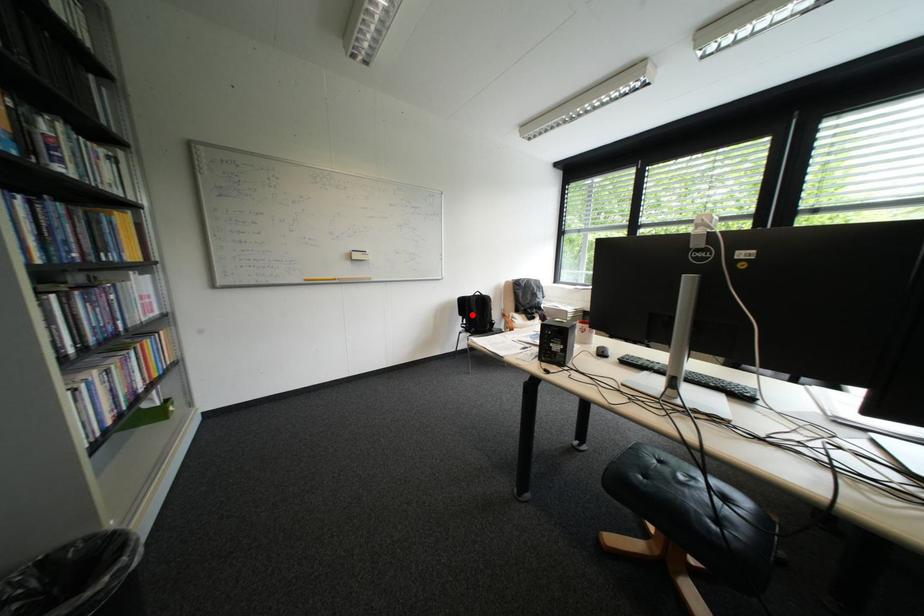
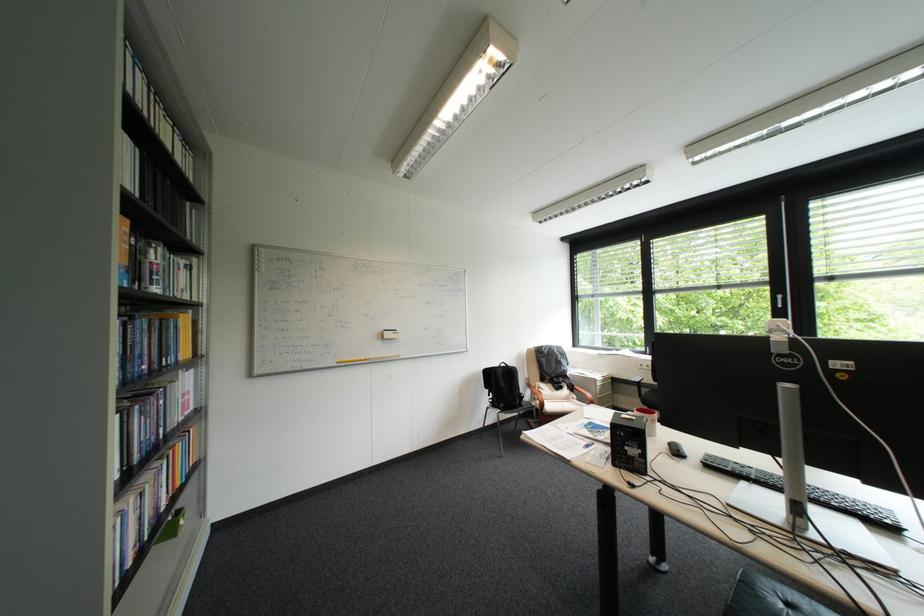
Question: I am providing you with two images of the same scene from different viewpoints. A red point is shown in image1. For the corresponding object point in image2, is it positioned nearer or farther from the camera?

Choices:
 (A) Nearer
 (B) Farther

Answer: (B)